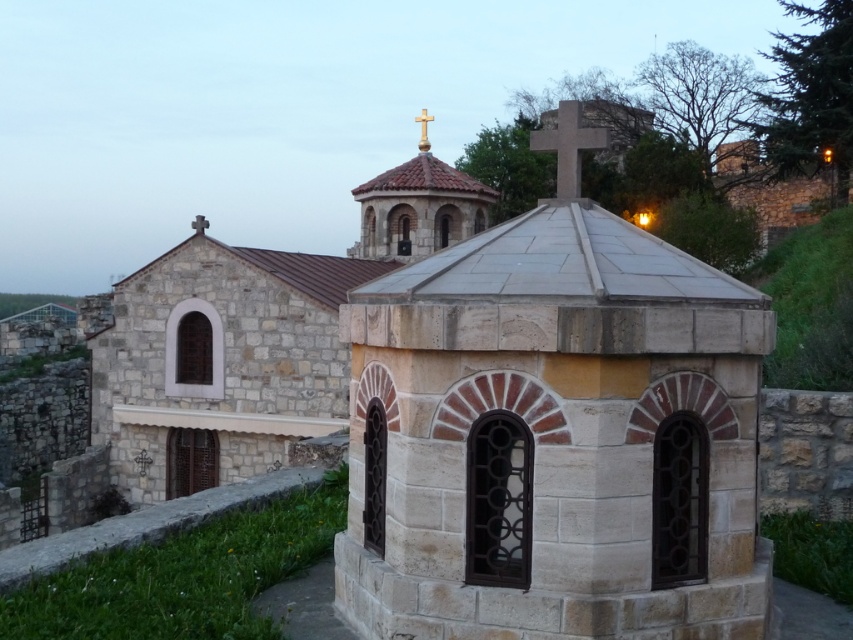
Question: Which point is farther to the camera?

Choices:
 (A) (422, 145)
 (B) (669, 378)

Answer: (A)

Question: Among these points, which one is farthest from the camera?

Choices:
 (A) pos(570,195)
 (B) pos(598,262)
 (C) pos(419,116)

Answer: (C)

Question: Observing the image, what is the correct spatial positioning of stone chapel at center in reference to smooth stone cross at upper center?

Choices:
 (A) above
 (B) below

Answer: (B)

Question: Estimate the real-world distances between objects in this image. Which object is farther from the smooth stone cross at upper center?

Choices:
 (A) wooden cross at center
 (B) stone chapel at center

Answer: (A)

Question: Where is stone chapel at center located in relation to smooth stone cross at upper center in the image?

Choices:
 (A) above
 (B) below

Answer: (B)

Question: Is smooth stone cross at upper center positioned in front of wooden cross at center?

Choices:
 (A) no
 (B) yes

Answer: (B)